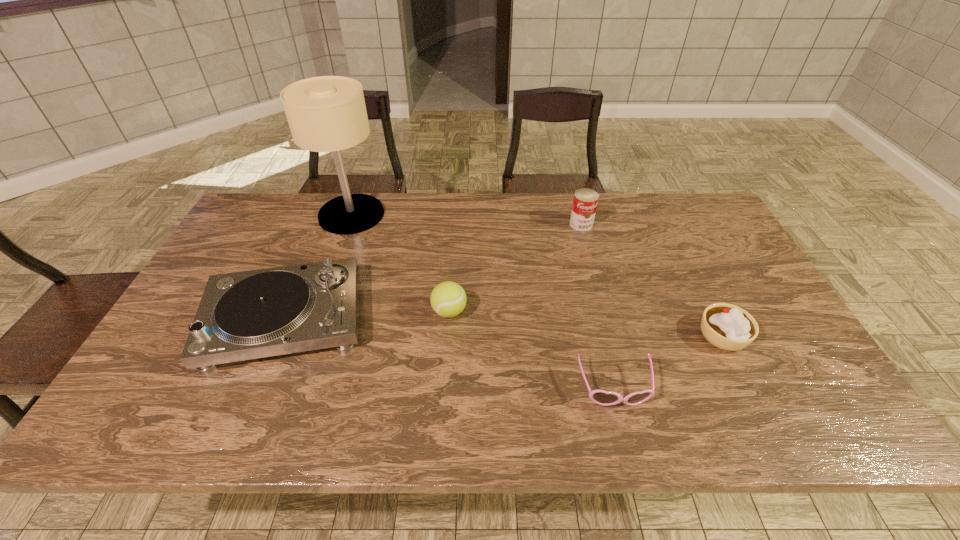
Where is `object that is the second closest to the tallest object`? The image size is (960, 540). object that is the second closest to the tallest object is located at coordinates (448, 299).

This screenshot has width=960, height=540. I want to click on the third closest object relative to the record player, so (x=601, y=397).

You are a GUI agent. You are given a task and a screenshot of the screen. Output one action in this format:
    pyautogui.click(x=<x>, y=<y>)
    Task: Click on the free spot that satisfies the following two spatial constraints: 1. on the front side of the whipped cream; 2. on the right side of the record player
    
    Given the screenshot: What is the action you would take?
    pyautogui.click(x=278, y=335)